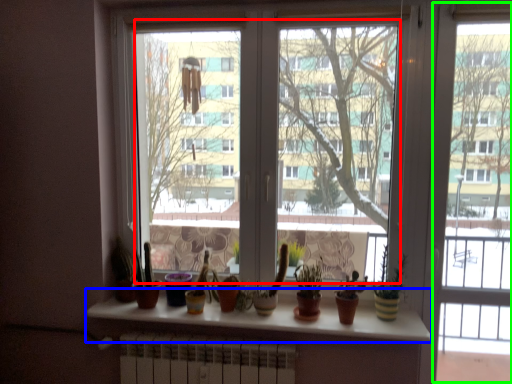
Question: Based on their relative distances, which object is farther from glass window (highlighted by a red box)? Choose from window sill (highlighted by a blue box) and screen door (highlighted by a green box).

Choices:
 (A) window sill
 (B) screen door

Answer: (B)